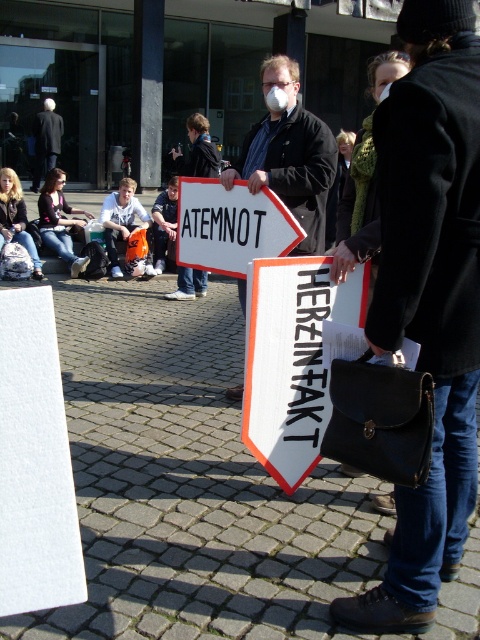
Question: Which object is positioned closest to the white matte sign at center?

Choices:
 (A) white cotton shirt at center
 (B) white plastic sign at center
 (C) matte black jacket at center
 (D) jeans at lower left

Answer: (C)

Question: Does white matte sign at center appear under white cotton shirt at center?

Choices:
 (A) yes
 (B) no

Answer: (A)

Question: Does matte black jacket at center come behind white plastic sign at center?

Choices:
 (A) yes
 (B) no

Answer: (A)

Question: Which object is closer to the camera taking this photo?

Choices:
 (A) white plastic sign at center
 (B) jeans at lower left

Answer: (A)

Question: Which of the following is the farthest from the observer?

Choices:
 (A) white cotton shirt at center
 (B) jeans at lower left
 (C) white matte sign at center

Answer: (A)

Question: From the image, what is the correct spatial relationship of matte black jacket at center in relation to jeans at lower left?

Choices:
 (A) right
 (B) left

Answer: (A)